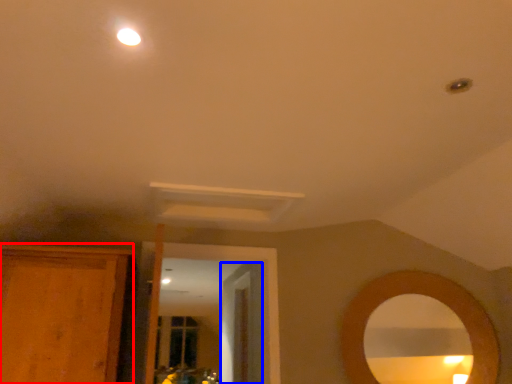
Question: Which object appears farthest to the camera in this image, cabinetry (highlighted by a red box) or door (highlighted by a blue box)?

Choices:
 (A) cabinetry
 (B) door

Answer: (B)